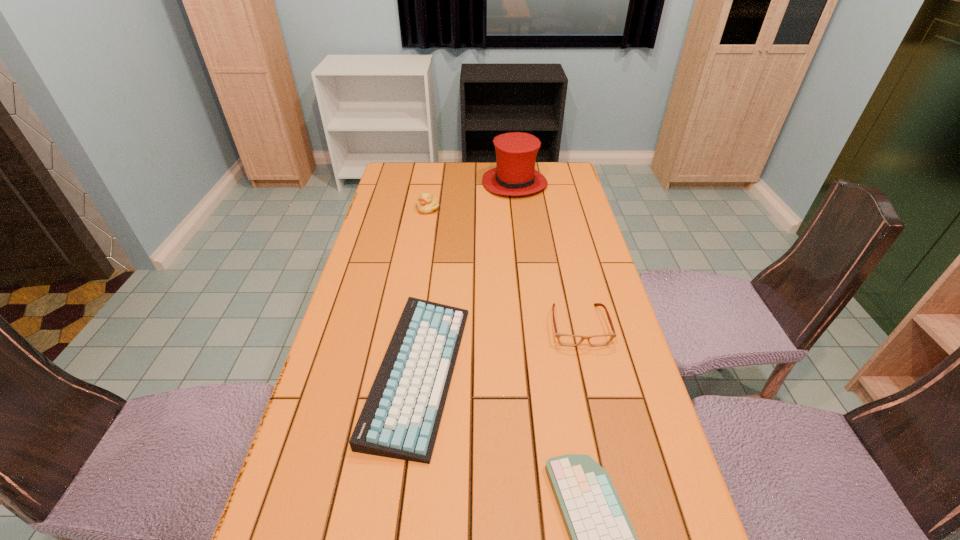
The width and height of the screenshot is (960, 540). Find the location of `the farthest object`. the farthest object is located at coordinates (515, 175).

At what (x,y) coordinates should I click in order to perform the action: click on the tallest object. Please return your answer as a coordinate pair (x, y). This screenshot has width=960, height=540. Looking at the image, I should click on (515, 175).

This screenshot has width=960, height=540. I want to click on the fourth shortest object, so click(427, 203).

At what (x,y) coordinates should I click in order to perform the action: click on the second farthest object. Please return your answer as a coordinate pair (x, y). This screenshot has height=540, width=960. Looking at the image, I should click on (427, 203).

Where is `spectacles`? Image resolution: width=960 pixels, height=540 pixels. spectacles is located at coordinates (564, 339).

At what (x,y) coordinates should I click in order to perform the action: click on the left computer keyboard. Please return your answer as a coordinate pair (x, y). Looking at the image, I should click on (400, 419).

You are a GUI agent. You are given a task and a screenshot of the screen. Output one action in this format:
    pyautogui.click(x=<x>, y=<y>)
    Task: Click on the free space located on the left of the farthest object
    
    Given the screenshot: What is the action you would take?
    pyautogui.click(x=444, y=184)

Identify the location of vacant space located 0.230m on the front-facing side of the second tallest object. (420, 254).

Locate an element on the screen. vacant space located 0.080m on the front-facing side of the spectacles is located at coordinates (590, 374).

You are a GUI agent. You are given a task and a screenshot of the screen. Output one action in this format:
    pyautogui.click(x=<x>, y=<y>)
    Task: Click on the free space located 0.080m on the back of the left computer keyboard
    Image resolution: width=960 pixels, height=540 pixels.
    Given the screenshot: What is the action you would take?
    pyautogui.click(x=429, y=287)